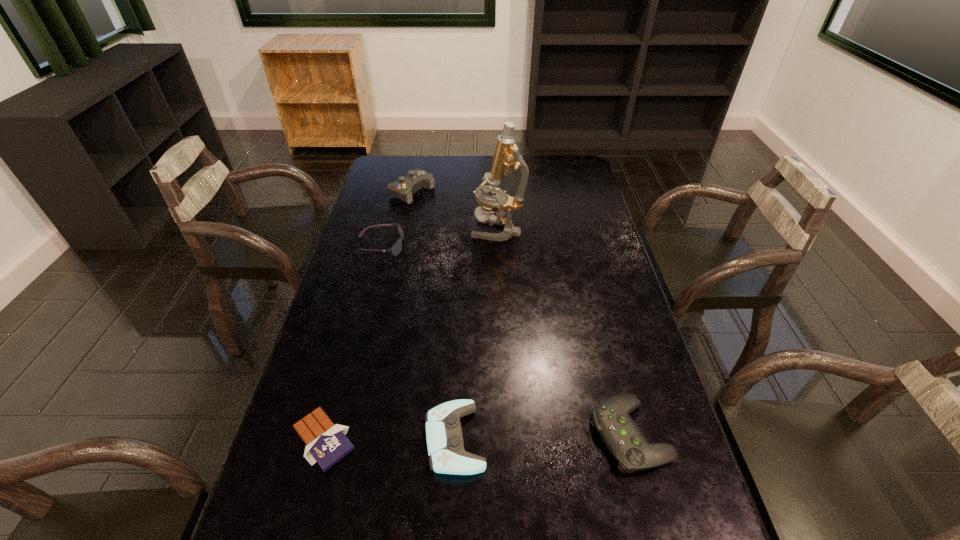
The image size is (960, 540). Identify the location of free space located on the right of the second control from left to right. (561, 439).

Locate an element on the screen. This screenshot has height=540, width=960. vacant space located on the left of the rightmost object is located at coordinates (479, 435).

Locate an element on the screen. vacant region located 0.240m on the right of the shortest object is located at coordinates (463, 440).

Locate an element on the screen. The width and height of the screenshot is (960, 540). object present at the far edge is located at coordinates (404, 188).

Find the location of a particular element. The image size is (960, 540). control present at the left edge is located at coordinates tap(404, 188).

I want to click on sunglasses present at the left edge, so click(397, 247).

At what (x,y) coordinates should I click in order to perform the action: click on chocolate bar that is positioned at the left edge. Please return your answer as a coordinate pair (x, y). This screenshot has width=960, height=540. Looking at the image, I should click on (327, 443).

The height and width of the screenshot is (540, 960). What are the coordinates of `object at the right edge` in the screenshot? It's located at (623, 438).

Locate an element on the screen. The width and height of the screenshot is (960, 540). object present at the far left corner is located at coordinates (404, 188).

At what (x,y) coordinates should I click in order to perform the action: click on vacant region at the far edge of the desktop. Please return your answer as a coordinate pair (x, y). The height and width of the screenshot is (540, 960). Looking at the image, I should click on (454, 170).